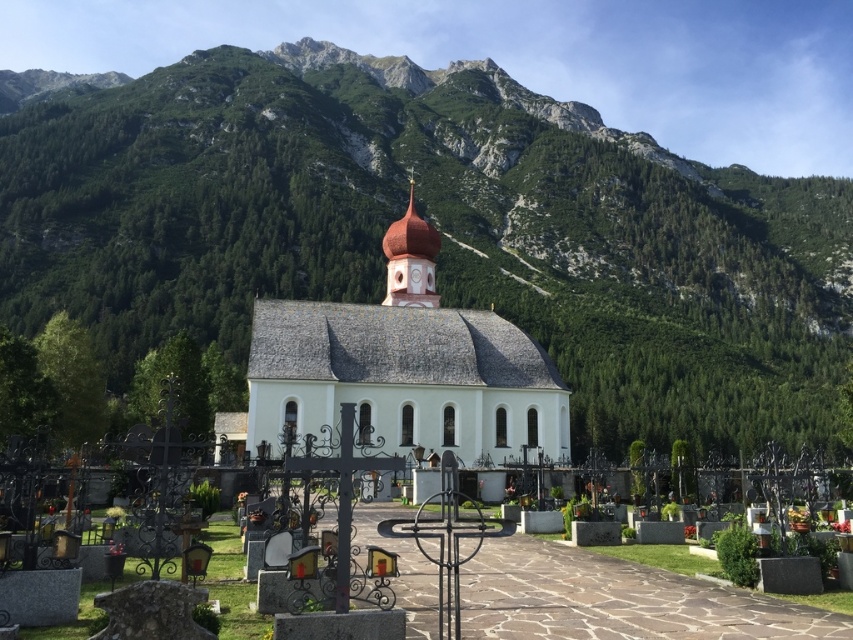
Between smooth concrete tombstones at center and smooth white steeple at center, which one appears on the left side from the viewer's perspective?

smooth white steeple at center

Can you confirm if smooth concrete tombstones at center is positioned to the left of smooth white steeple at center?

No, smooth concrete tombstones at center is not to the left of smooth white steeple at center.

Is point (401, 564) behind point (431, 296)?

No, it is in front of (431, 296).

Image resolution: width=853 pixels, height=640 pixels. Find the location of `smooth concrete tombstones at center`. smooth concrete tombstones at center is located at coordinates (616, 600).

Does white stone church at center have a lesser height compared to smooth concrete tombstones at center?

Incorrect, white stone church at center's height does not fall short of smooth concrete tombstones at center's.

Between white stone church at center and smooth concrete tombstones at center, which one has less height?

With less height is smooth concrete tombstones at center.

Does point (410, 291) come closer to viewer compared to point (817, 609)?

No, (410, 291) is further to viewer.

Locate an element on the screen. white stone church at center is located at coordinates (405, 368).

Is point (801, 316) farther from viewer compared to point (250, 355)?

That is True.

Who is positioned more to the right, green forested mountain at upper center or white stone church at center?

Positioned to the right is white stone church at center.

Does point (135, 355) come farther from viewer compared to point (422, 305)?

Yes, point (135, 355) is behind point (422, 305).

At what (x,y) coordinates should I click in order to perform the action: click on green forested mountain at upper center. Please return your answer as a coordinate pair (x, y). The width and height of the screenshot is (853, 640). Looking at the image, I should click on (434, 225).